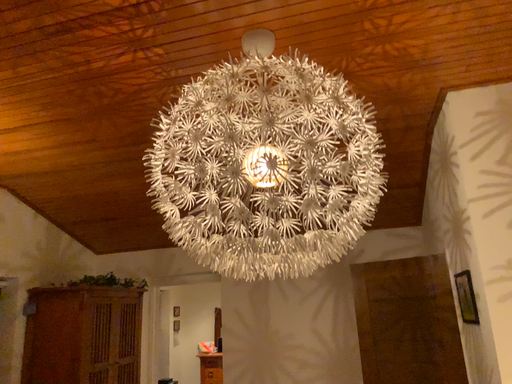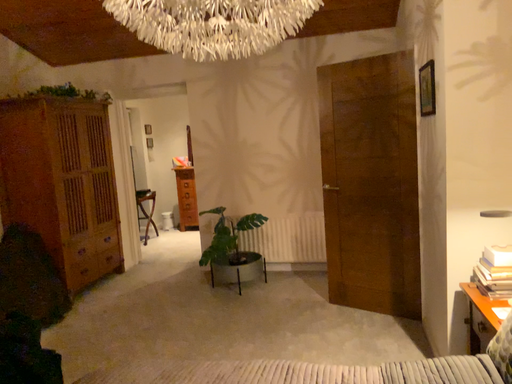
Question: Which way did the camera rotate in the video?

Choices:
 (A) rotated downward
 (B) rotated upward

Answer: (A)